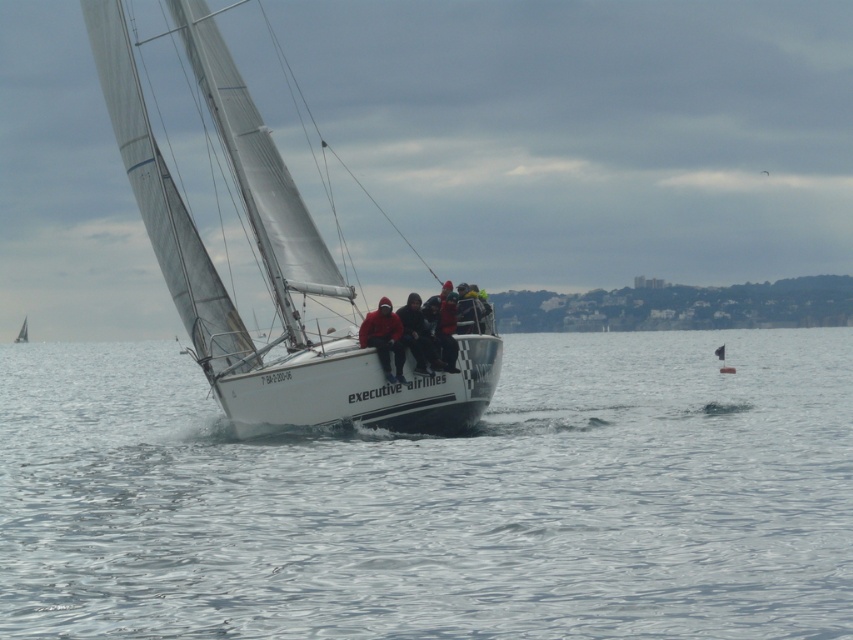
You are a passenger on the white sailboat at center. You want to jump into the water near the front of the boat. Which object must you pass through to reach the clear water at sailboat front?

You must pass through the white sailboat at center to reach the clear water at sailboat front since the clear water at sailboat front is positioned under the white sailboat at center.

You are a passenger on the white matte sailboat at center. You want to move to the red fleece jackets at center. Is there enough space to walk directly to them?

The white matte sailboat at center is positioned over red fleece jackets at center, so there is no space between them. You cannot walk directly to the red fleece jackets at center.